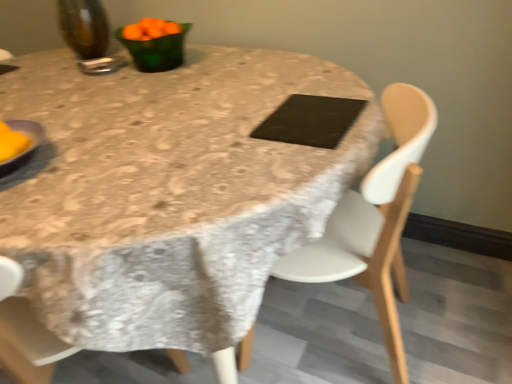
What are the coordinates of `vacant region to the left of metallic silver spoon at upper left, the first tableware from the left` in the screenshot? It's located at (62, 67).